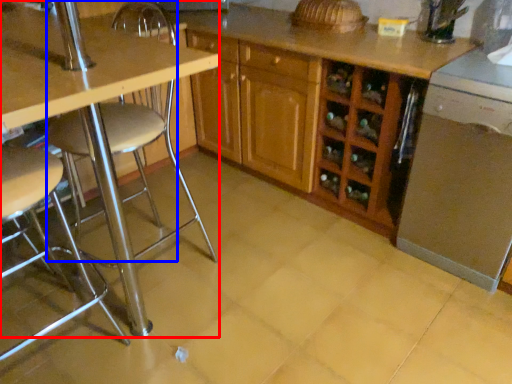
Question: Which object appears farthest to the camera in this image, table (highlighted by a red box) or swivel chair (highlighted by a blue box)?

Choices:
 (A) table
 (B) swivel chair

Answer: (A)